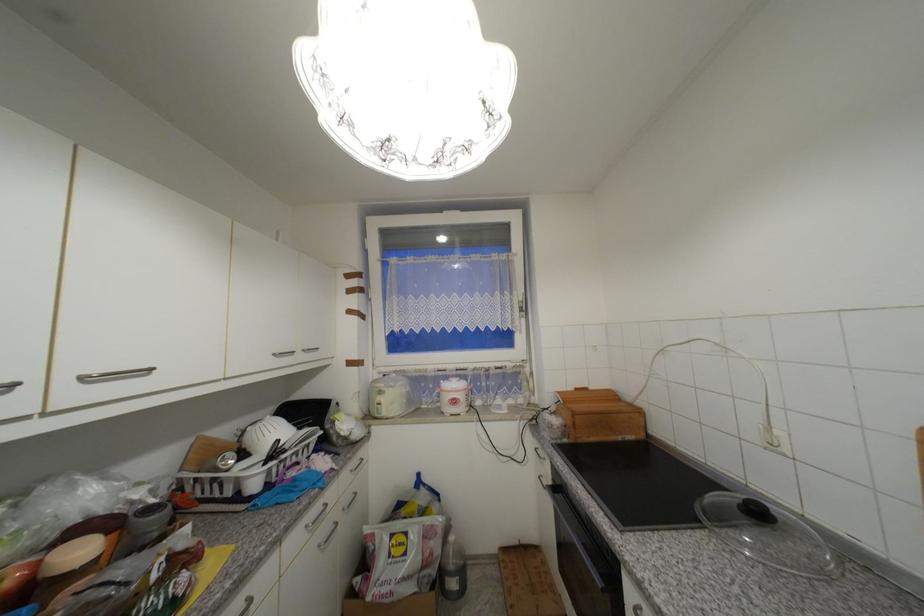
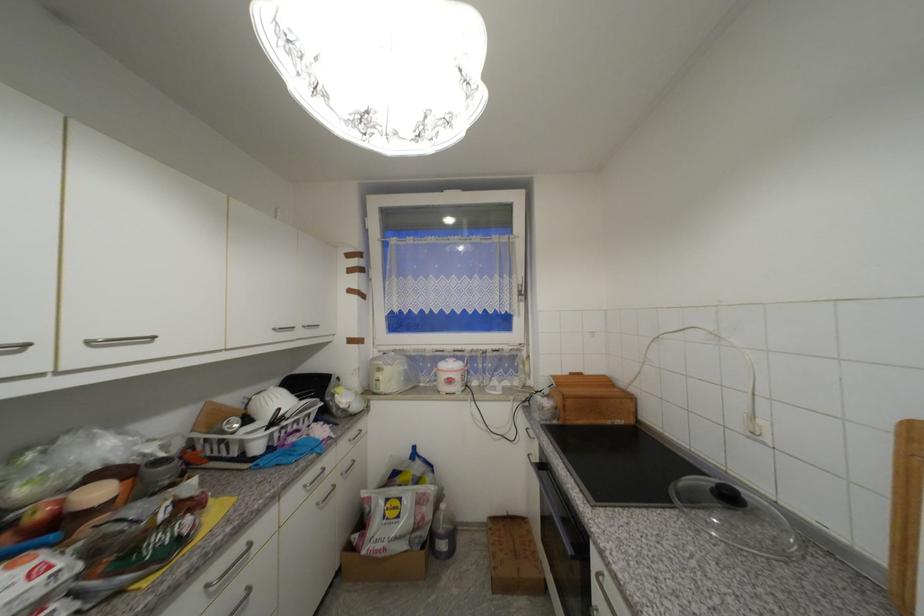
In the second image, find the point that corresponds to (324,546) in the first image.

(322, 505)